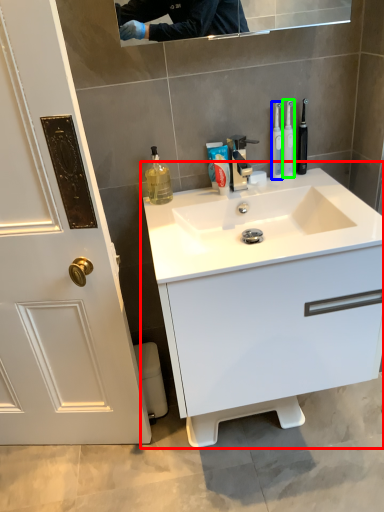
Question: Estimate the real-world distances between objects in this image. Which object is farther from bathroom cabinet (highlighted by a red box), mouthwash (highlighted by a blue box) or toothbrush (highlighted by a green box)?

Choices:
 (A) mouthwash
 (B) toothbrush

Answer: (B)